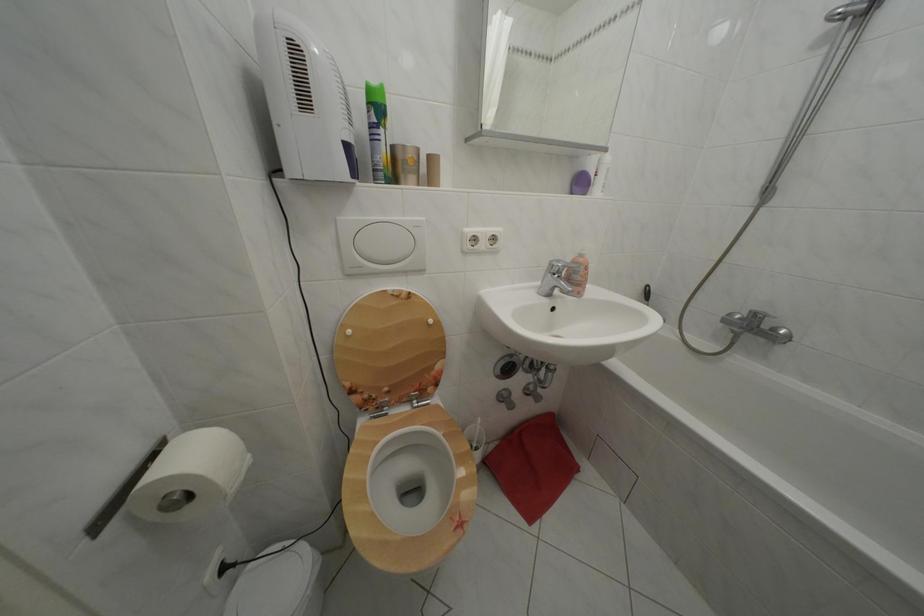
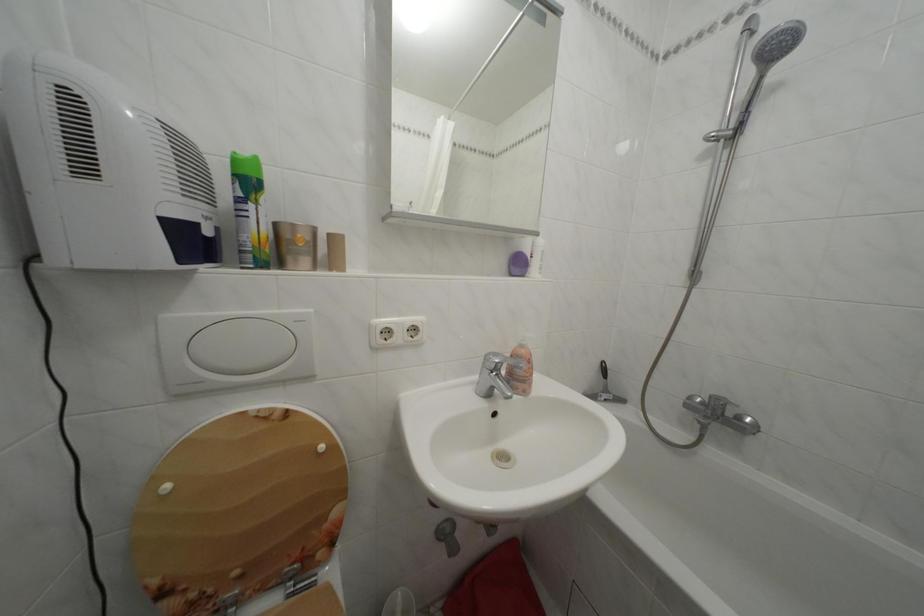
Find the pixel in the second image that matches (x=358, y=338) in the first image.

(176, 493)